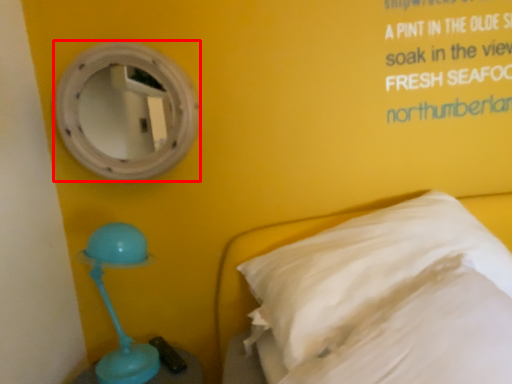
Question: From the image's perspective, considering the relative positions of mirror (annotated by the red box) and pillow in the image provided, where is mirror (annotated by the red box) located with respect to the staircase?

Choices:
 (A) above
 (B) below

Answer: (A)